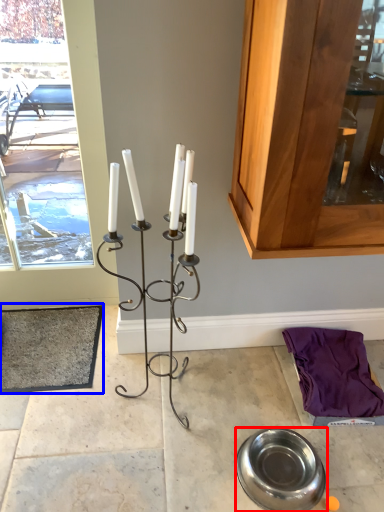
Question: Which point is closer to the camera, tableware (highlighted by a red box) or doormat (highlighted by a blue box)?

Choices:
 (A) tableware
 (B) doormat

Answer: (A)